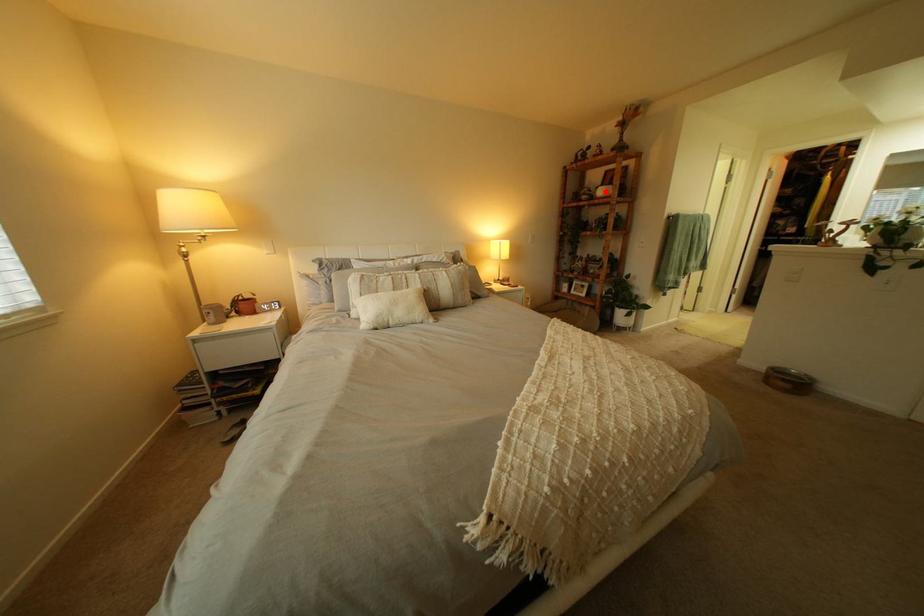
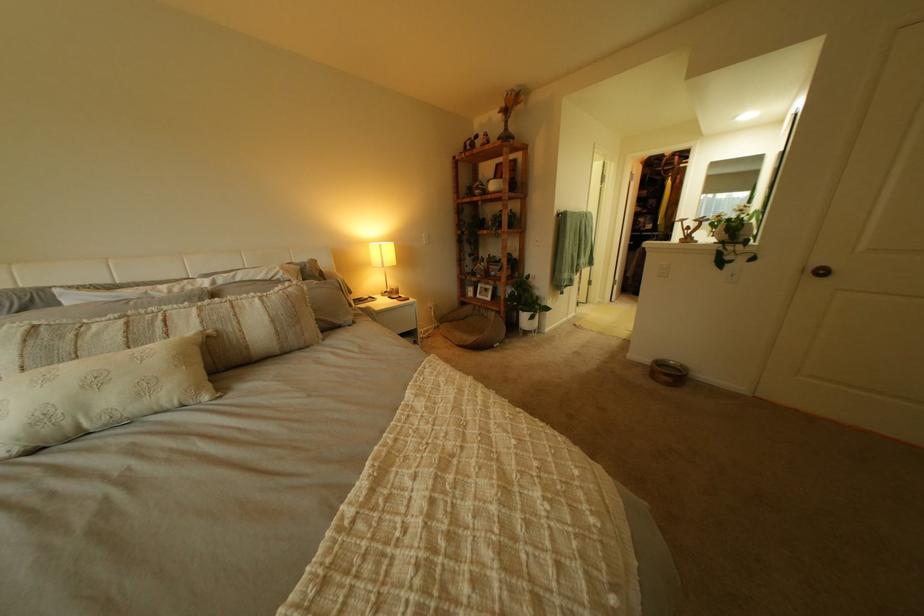
Find the pixel in the second image that matches the highlighted location in the first image.

(497, 185)